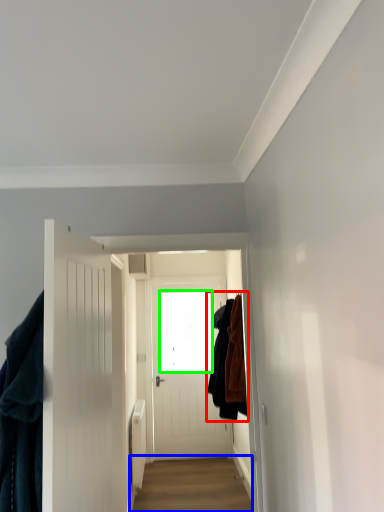
Question: Estimate the real-world distances between objects in this image. Which object is farther from clothing (highlighted by a red box), alley (highlighted by a blue box) or window screen (highlighted by a green box)?

Choices:
 (A) alley
 (B) window screen

Answer: (B)